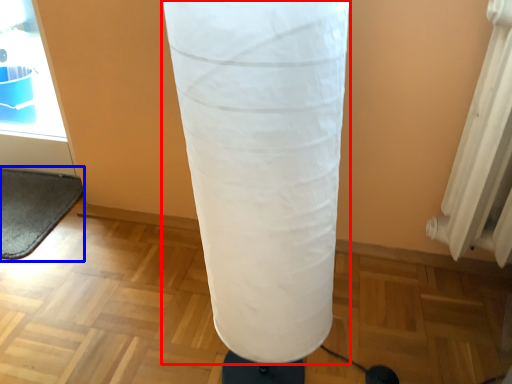
Question: Which point is closer to the camera, punching bag (highlighted by a red box) or yoga mat (highlighted by a blue box)?

Choices:
 (A) punching bag
 (B) yoga mat

Answer: (A)